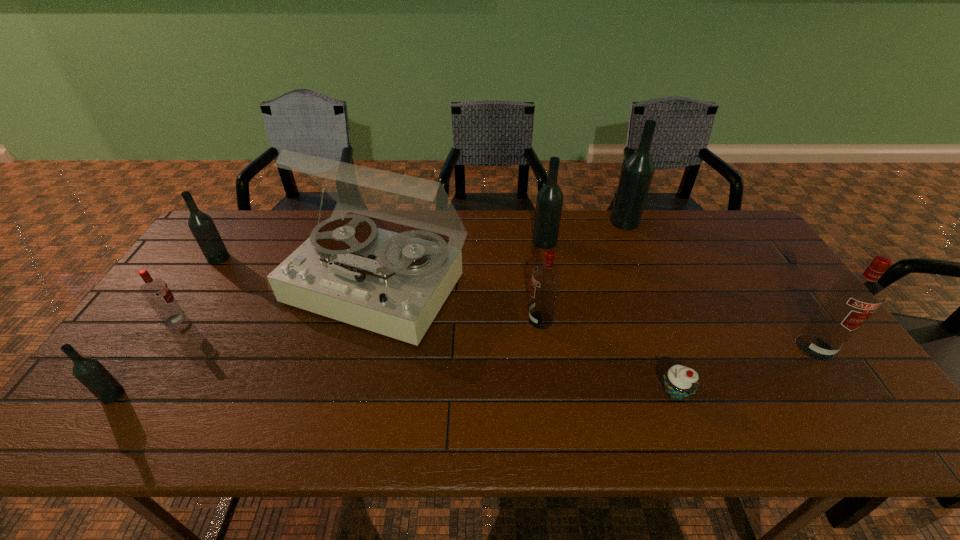
In the image, there is a desktop. At what (x,y) coordinates should I click in order to perform the action: click on vacant space at the far edge. Please return your answer as a coordinate pair (x, y). Looking at the image, I should click on (589, 224).

In the image, there is a desktop. Where is `vacant space at the near edge`? This screenshot has height=540, width=960. vacant space at the near edge is located at coordinates (297, 406).

Identify the location of vacant space at the left edge of the desktop. (140, 368).

Find the location of a particular element. blank area at the right edge is located at coordinates (780, 279).

The image size is (960, 540). I want to click on vacant space in between the second smallest red vodka and the farthest vodka, so click(583, 271).

Find the location of a particular element. vacant space in between the fourth object from left to right and the leftmost red vodka is located at coordinates (276, 302).

Locate an element on the screen. This screenshot has width=960, height=540. free spot between the second vodka from right to left and the shortest object is located at coordinates (x=650, y=307).

At what (x,y) coordinates should I click in order to perform the action: click on vacant space that's between the nearest vodka and the second black vodka from right to left. Please return your answer as a coordinate pair (x, y). The image size is (960, 540). Looking at the image, I should click on (328, 318).

Where is `free space between the cupcake and the white record player`? The image size is (960, 540). free space between the cupcake and the white record player is located at coordinates (526, 338).

Identify the location of free space between the sixth object from right to left and the smallest red vodka. This screenshot has height=540, width=960. (276, 302).